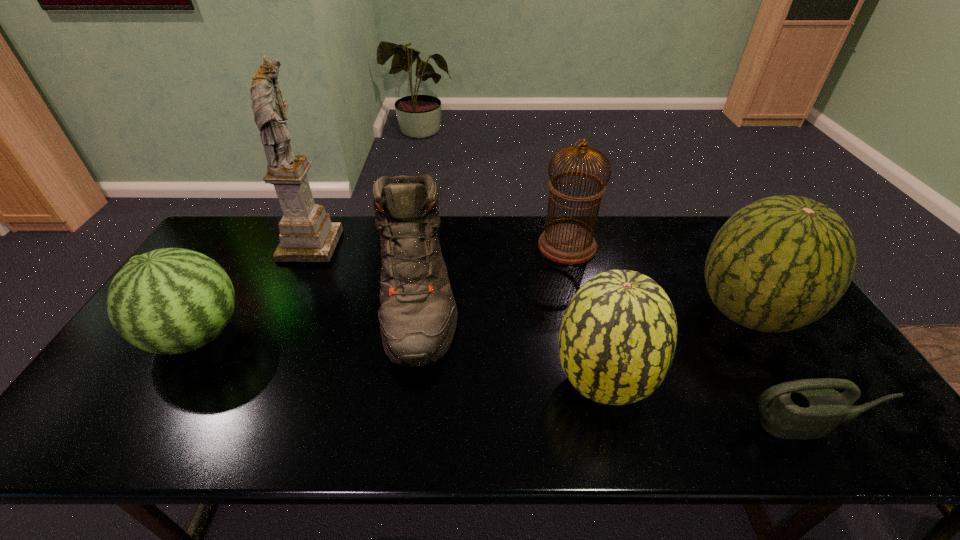
What are the coordinates of `vacant space that satisfies the following two spatial constraints: 1. on the front-facing side of the second watermelon from right to left; 2. on the right side of the birdcage` in the screenshot? It's located at [x=599, y=383].

Where is `vacant region that satisfies the following two spatial constraints: 1. on the front-facing side of the birdcage; 2. on the back side of the second watermelon from left to right`? vacant region that satisfies the following two spatial constraints: 1. on the front-facing side of the birdcage; 2. on the back side of the second watermelon from left to right is located at coordinates (599, 383).

At what (x,y) coordinates should I click in order to perform the action: click on free point that satisfies the following two spatial constraints: 1. on the back side of the rightmost watermelon; 2. on the front-facing side of the birdcage. Please return your answer as a coordinate pair (x, y). Image resolution: width=960 pixels, height=540 pixels. Looking at the image, I should click on (707, 246).

Locate an element on the screen. The height and width of the screenshot is (540, 960). vacant position in the image that satisfies the following two spatial constraints: 1. on the front-facing side of the sculpture; 2. on the left side of the rightmost watermelon is located at coordinates (278, 313).

Identify the location of vacant point that satisfies the following two spatial constraints: 1. on the front side of the fifth object from right to left; 2. on the left side of the second watermelon from left to right. (404, 383).

In order to click on free spot that satisfies the following two spatial constraints: 1. on the front-facing side of the birdcage; 2. on the front side of the leftmost watermelon in this screenshot , I will do `click(588, 336)`.

I want to click on free space that satisfies the following two spatial constraints: 1. on the front-facing side of the rightmost watermelon; 2. on the left side of the birdcage, so click(x=583, y=313).